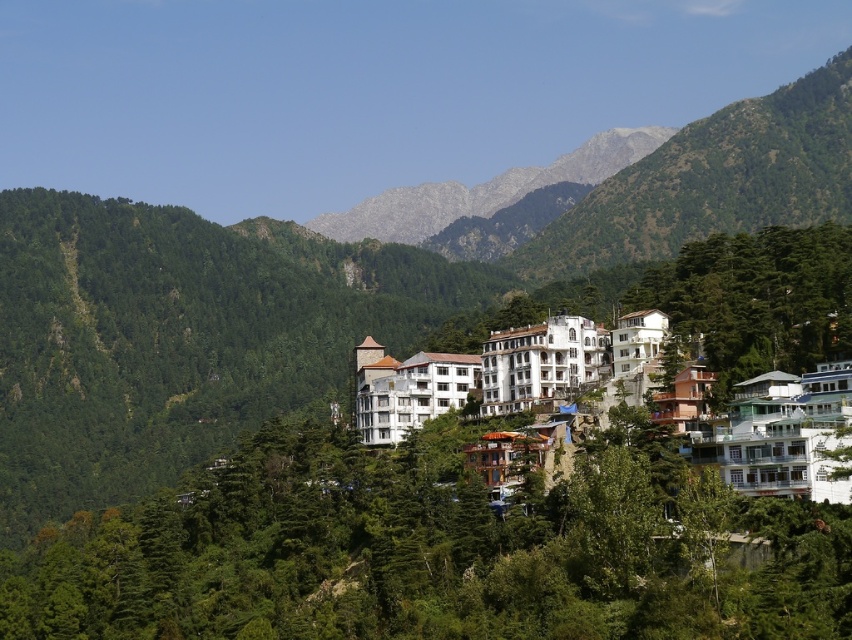
You are standing at the point marked as point (432,550) in the image. Looking around, you see a green leafy tree at center. What object is exactly at your current position?

The green leafy tree at center is exactly at point (432,550).